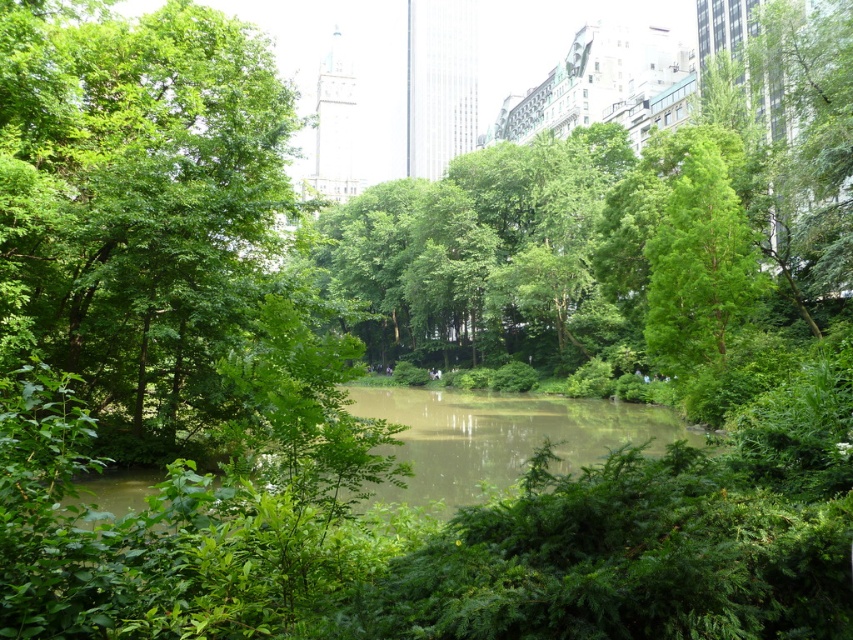
Question: In this image, where is green leafy tree at center located relative to green leafy tree at upper right?

Choices:
 (A) right
 (B) left

Answer: (B)

Question: Does green leafy tree at center have a smaller size compared to green leafy tree at upper right?

Choices:
 (A) no
 (B) yes

Answer: (B)

Question: Among these objects, which one is farthest from the camera?

Choices:
 (A) green leafy tree at center
 (B) green leafy tree at upper right

Answer: (B)

Question: Which of the following is the farthest from the observer?

Choices:
 (A) green leafy tree at center
 (B) green leafy tree at upper right

Answer: (B)

Question: Does green leafy tree at center lie behind green leafy tree at upper right?

Choices:
 (A) yes
 (B) no

Answer: (B)